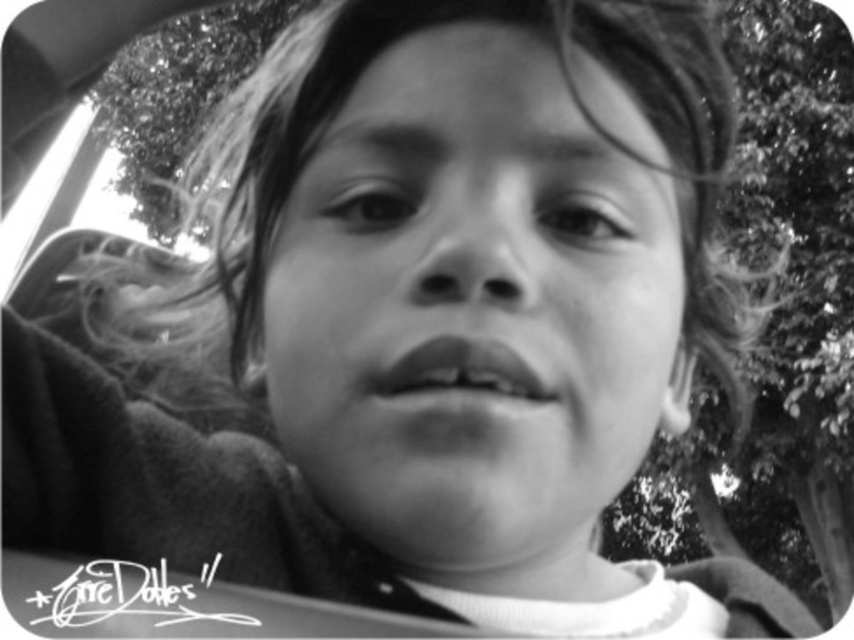
Question: Which object appears farthest from the camera in this image?

Choices:
 (A) smooth skin lips at center
 (B) smooth skin face at center

Answer: (A)

Question: Among these objects, which one is nearest to the camera?

Choices:
 (A) smooth skin lips at center
 (B) smooth skin face at center

Answer: (B)

Question: Can you confirm if smooth skin face at center is positioned below smooth skin lips at center?

Choices:
 (A) yes
 (B) no

Answer: (B)

Question: Is smooth skin face at center above smooth skin lips at center?

Choices:
 (A) yes
 (B) no

Answer: (A)

Question: Does smooth skin face at center appear on the left side of smooth skin lips at center?

Choices:
 (A) yes
 (B) no

Answer: (B)

Question: Which point is closer to the camera?

Choices:
 (A) smooth skin lips at center
 (B) smooth skin face at center

Answer: (B)